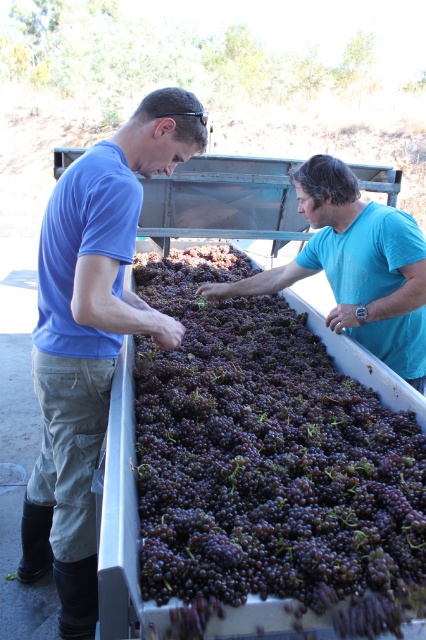
You are standing at the position of the person on the left. You need to move to the point labeled point (74, 545) and then to point (336, 236). Which point will you reach first?

You will reach point (74, 545) first because it is in front of point (336, 236) from your current position.

You are a worker in the vineyard and need to know which object takes up more space in the image between the purple matte grapes at center and the blue cotton shirt at left. Which one is it?

The blue cotton shirt at left occupies more space than the purple matte grapes at center according to the description.